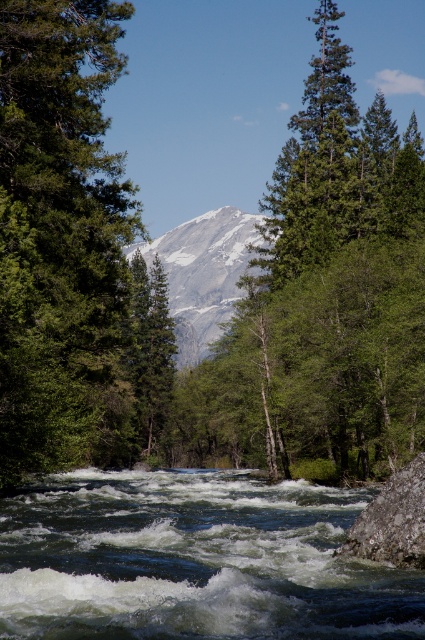
Question: Which point is farther to the camera?

Choices:
 (A) snowy granite mountain at center
 (B) green matte tree at center
 (C) gray rough rock at lower right

Answer: (A)

Question: Can you confirm if snowy granite mountain at center is positioned above gray rough rock at lower right?

Choices:
 (A) no
 (B) yes

Answer: (B)

Question: Based on their relative distances, which object is nearer to the gray rough rock at lower right?

Choices:
 (A) snowy granite mountain at center
 (B) green matte tree at center

Answer: (B)

Question: Which of the following is the closest to the observer?

Choices:
 (A) (186, 221)
 (B) (118, 330)
 (C) (413, 528)

Answer: (C)

Question: From the image, what is the correct spatial relationship of green matte tree at center in relation to snowy granite mountain at center?

Choices:
 (A) above
 (B) below

Answer: (B)

Question: Is snowy granite mountain at center thinner than gray rough rock at lower right?

Choices:
 (A) no
 (B) yes

Answer: (A)